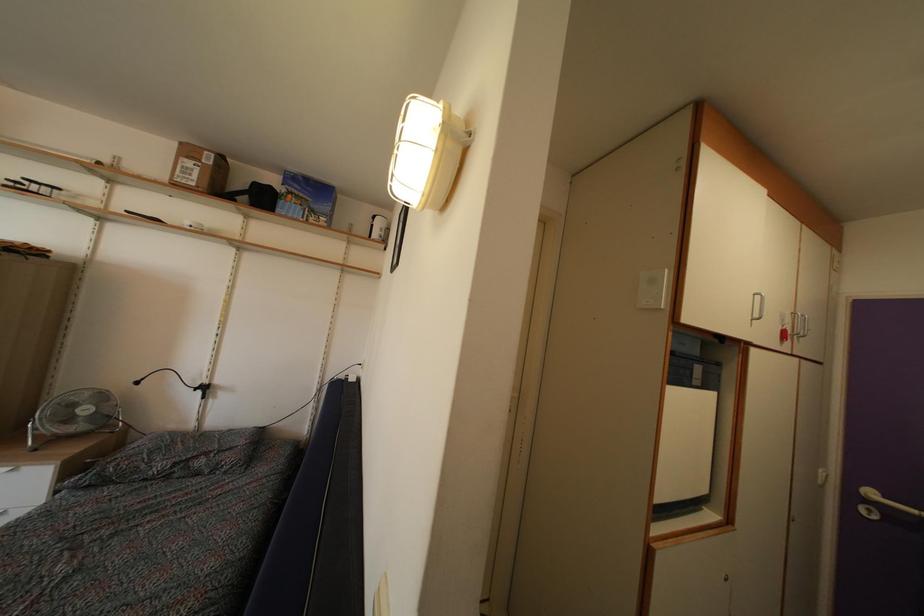
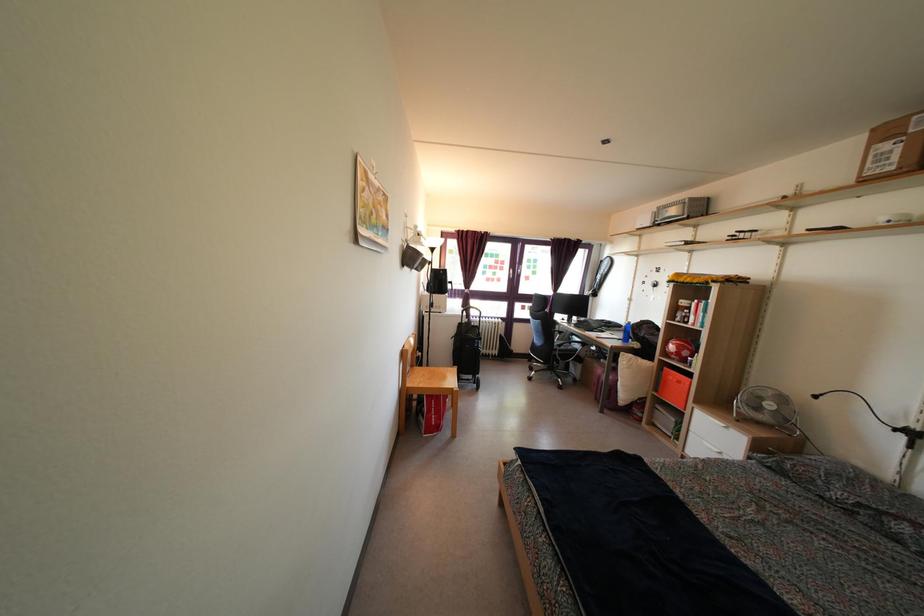
Question: The images are taken continuously from a first-person perspective. In which direction is your viewpoint rotating?

Choices:
 (A) Left
 (B) Right
 (C) Up
 (D) Down

Answer: (A)